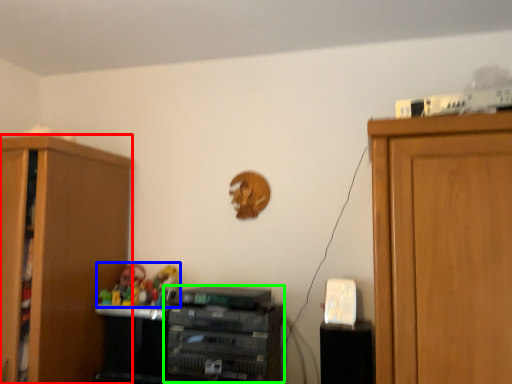
Question: Estimate the real-world distances between objects in this image. Which object is farther from cabinetry (highlighted by a red box), toy (highlighted by a blue box) or cabinetry (highlighted by a green box)?

Choices:
 (A) toy
 (B) cabinetry

Answer: (B)